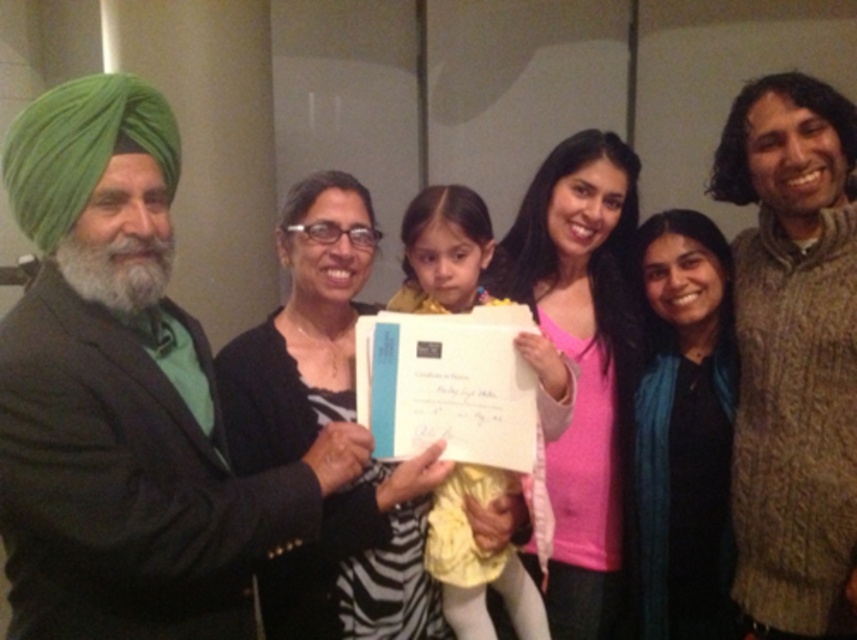
Question: Can you confirm if pink matte sweater at center is positioned to the right of pink matte shirt at center?

Choices:
 (A) no
 (B) yes

Answer: (B)

Question: Which point appears closest to the camera in this image?

Choices:
 (A) (31, 224)
 (B) (742, 308)
 (C) (352, 515)
 (D) (574, 330)

Answer: (A)

Question: Is green turban at left to the right of knitted beige sweater at right from the viewer's perspective?

Choices:
 (A) no
 (B) yes

Answer: (A)

Question: Based on their relative distances, which object is nearer to the pink matte shirt at center?

Choices:
 (A) black matte scarf at center
 (B) green turban at left
 (C) pink matte sweater at center
 (D) black matte cardigan at center

Answer: (D)

Question: Which object is positioned farthest from the knitted beige sweater at right?

Choices:
 (A) black matte scarf at center
 (B) black matte cardigan at center
 (C) pink matte shirt at center
 (D) green turban at left

Answer: (D)

Question: Is black matte cardigan at center further to the viewer compared to pink matte shirt at center?

Choices:
 (A) yes
 (B) no

Answer: (B)